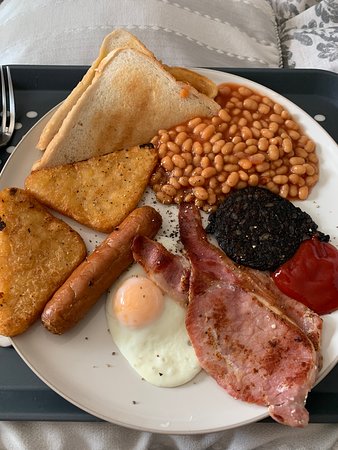
You are a GUI agent. You are given a task and a screenshot of the screen. Output one action in this format:
    pyautogui.click(x=<x>, y=<y>)
    Task: Click on the dark blue inside of tray
    
    Given the screenshot: What is the action you would take?
    pyautogui.click(x=293, y=86), pyautogui.click(x=40, y=80)